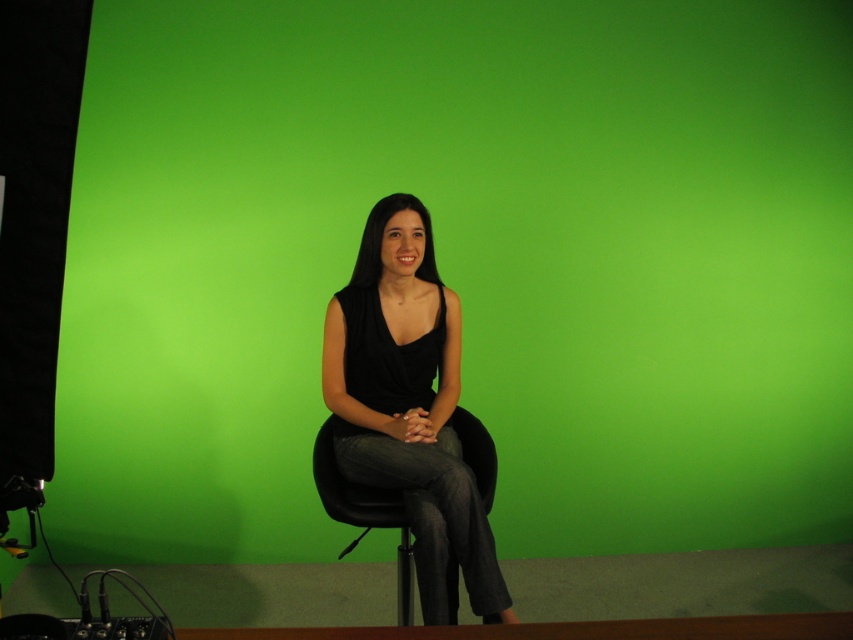
Question: Considering the relative positions of black matte/black fabric at center and black plastic chair at center in the image provided, where is black matte/black fabric at center located with respect to black plastic chair at center?

Choices:
 (A) left
 (B) right

Answer: (A)

Question: Is black matte/black fabric at center thinner than black plastic chair at center?

Choices:
 (A) yes
 (B) no

Answer: (A)

Question: Which object is farther from the camera taking this photo?

Choices:
 (A) black plastic chair at center
 (B) black matte/black fabric at center

Answer: (B)

Question: Is black matte/black fabric at center thinner than black plastic chair at center?

Choices:
 (A) no
 (B) yes

Answer: (B)